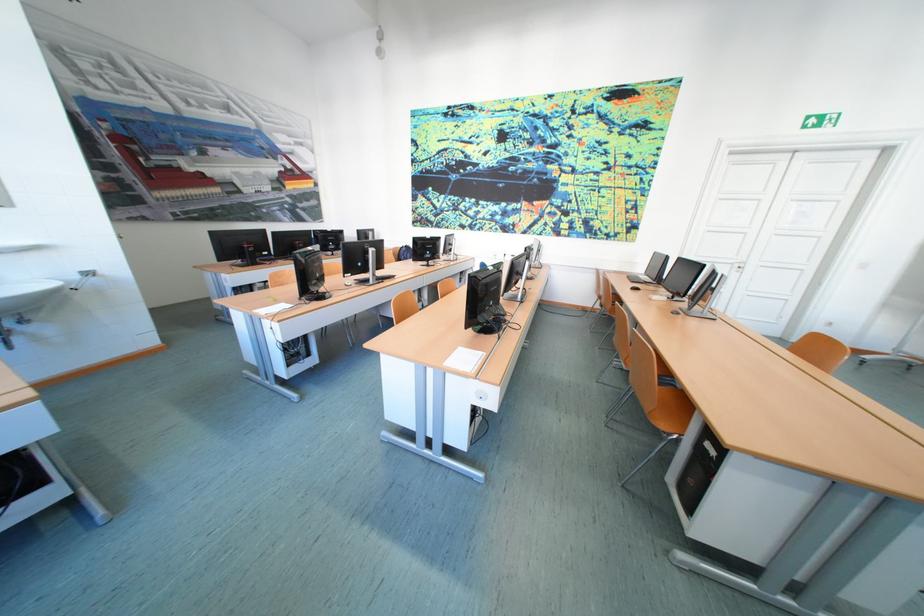
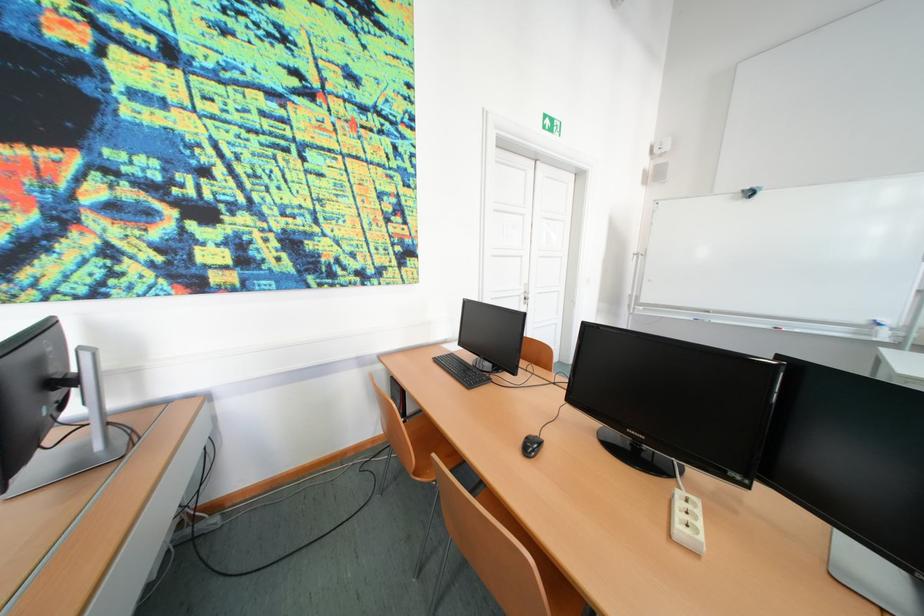
The point at (641, 278) is marked in the first image. Where is the corresponding point in the second image?

(450, 363)